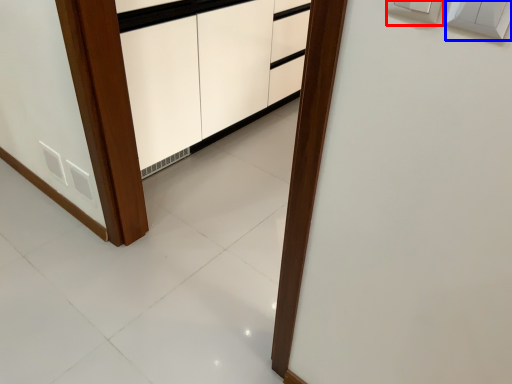
Question: Which point is closer to the camera, electric outlet (highlighted by a red box) or light switch (highlighted by a blue box)?

Choices:
 (A) electric outlet
 (B) light switch

Answer: (B)